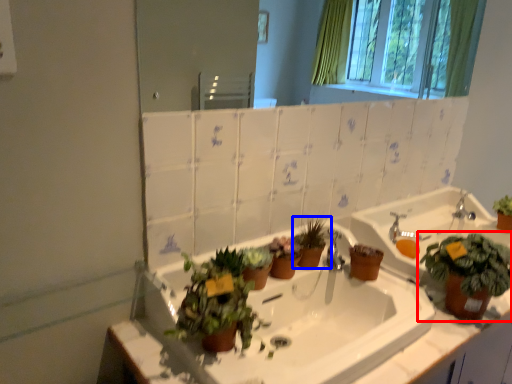
Question: Which point is further to the camera, houseplant (highlighted by a red box) or houseplant (highlighted by a blue box)?

Choices:
 (A) houseplant
 (B) houseplant

Answer: (B)